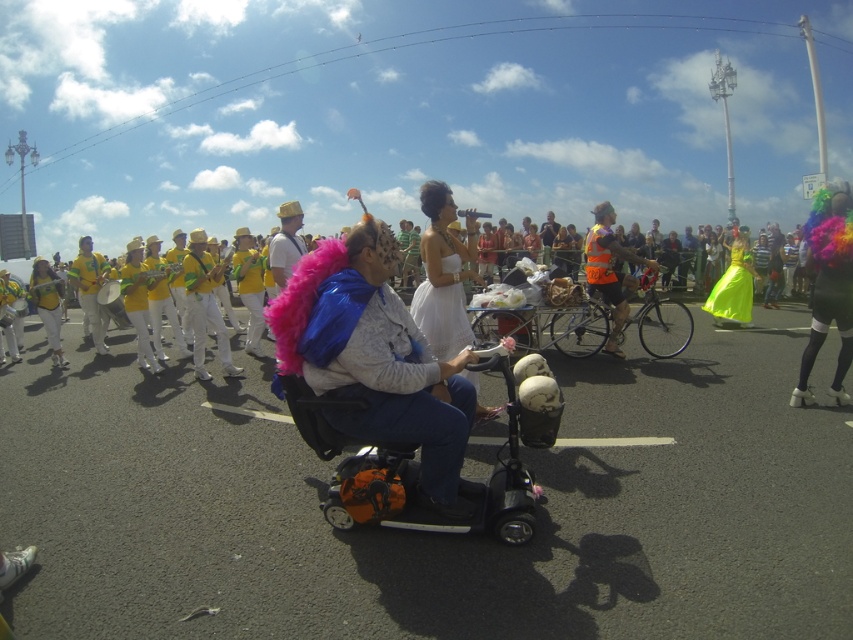
You are a photographer at the event and want to capture both the black plastic scooter at center and the neon yellow satin dress at right in a single frame. Since the scooter is smaller, where should you position your camera to ensure both objects are clearly visible?

Since the black plastic scooter at center is smaller than the neon yellow satin dress at right, you should position your camera closer to the black plastic scooter at center to balance their sizes in the frame.

You are a photographer at the parade and want to capture both the fuzzy pink boa at center and the neon yellow satin dress at right in a single photo. Based on their positions, which object should you focus on first to ensure both are in frame?

The fuzzy pink boa at center is to the left of the neon yellow satin dress at right, so you should focus on the fuzzy pink boa at center first to ensure both are in frame.

You are a photographer trying to capture both the black plastic scooter at center and the neon yellow satin dress at right in a single frame. Based on their positions, which object should you focus on first to ensure both are in the shot?

The black plastic scooter at center is positioned on the left side of neon yellow satin dress at right, so you should focus on the neon yellow satin dress at right first to ensure both are included in the frame.